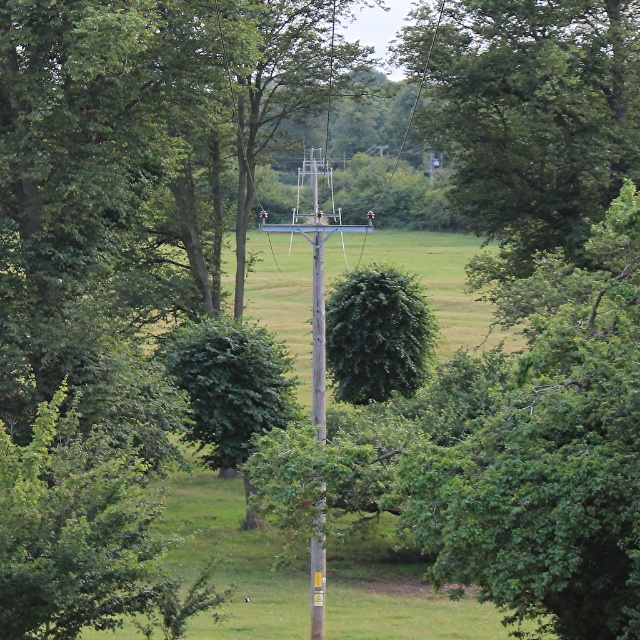
Which is more to the right, green leafy tree at center or wooden telegraph pole at center?

Positioned to the right is green leafy tree at center.

Is green leafy tree at center smaller than wooden telegraph pole at center?

No.

Does point (467, 26) lie behind point (314, 326)?

That is True.

This screenshot has height=640, width=640. In order to click on green leafy tree at center in this screenshot , I will do `click(531, 115)`.